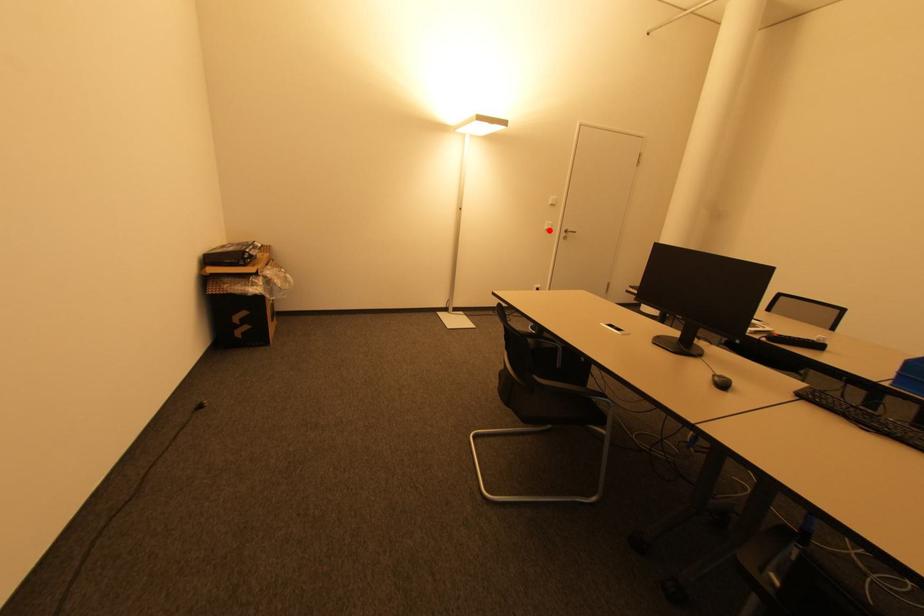
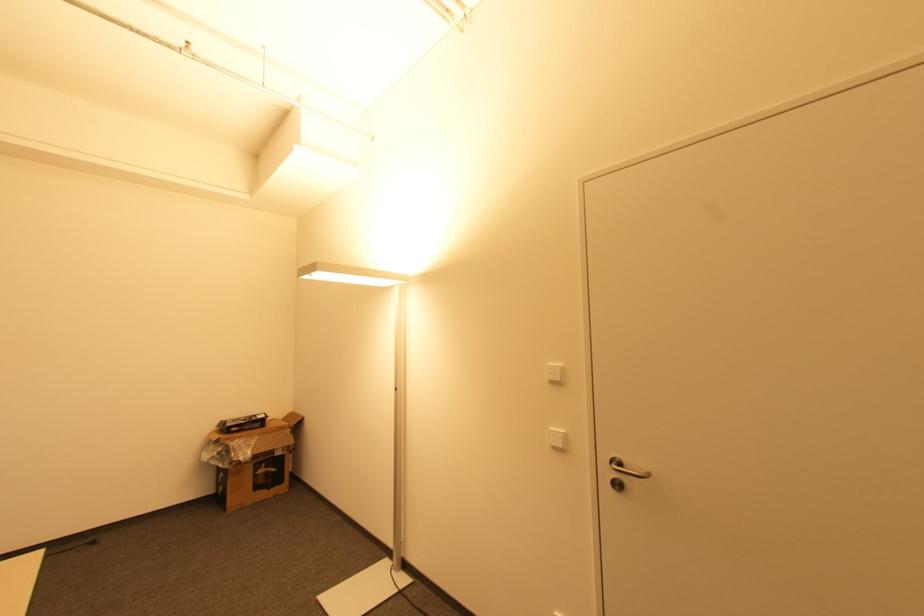
Locate, in the second image, the point that corresponds to the highlighted location in the first image.

(557, 448)